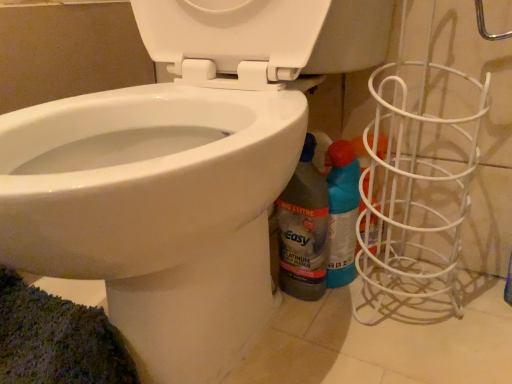
At what (x,y) coordinates should I click in order to perform the action: click on white glossy bidet at lower left. Please return your answer as a coordinate pair (x, y). Looking at the image, I should click on (156, 211).

Where is `translucent plastic bottle at lower right, the second cleaning product in the right-to-left sequence`? The image size is (512, 384). translucent plastic bottle at lower right, the second cleaning product in the right-to-left sequence is located at coordinates (304, 229).

From the image's perspective, would you say blue glossy spray can at lower right, which appears as the 1th cleaning product when viewed from the right, is shown under translucent plastic bottle at lower right, the second cleaning product in the right-to-left sequence?

Indeed, from the image's perspective, blue glossy spray can at lower right, which appears as the 1th cleaning product when viewed from the right, is shown beneath translucent plastic bottle at lower right, the second cleaning product in the right-to-left sequence.

From a real-world perspective, is blue glossy spray can at lower right, marked as the second cleaning product in a left-to-right arrangement, positioned under translucent plastic bottle at lower right, the second cleaning product in the right-to-left sequence, based on gravity?

Yes, from a real-world perspective, blue glossy spray can at lower right, marked as the second cleaning product in a left-to-right arrangement, is beneath translucent plastic bottle at lower right, the second cleaning product in the right-to-left sequence.

Does blue glossy spray can at lower right, marked as the second cleaning product in a left-to-right arrangement, come behind translucent plastic bottle at lower right, the second cleaning product in the right-to-left sequence?

Yes, blue glossy spray can at lower right, marked as the second cleaning product in a left-to-right arrangement, is further from the camera.

How different are the orientations of blue glossy spray can at lower right, which appears as the 1th cleaning product when viewed from the right, and translucent plastic bottle at lower right, the second cleaning product in the right-to-left sequence, in degrees?

They differ by 0.00751 degrees in their facing directions.

Is white glossy bidet at lower left aimed at blue glossy spray can at lower right, which appears as the 1th cleaning product when viewed from the right?

No, white glossy bidet at lower left is not facing towards blue glossy spray can at lower right, which appears as the 1th cleaning product when viewed from the right.

From a real-world perspective, which is physically above, white glossy bidet at lower left or blue glossy spray can at lower right, marked as the second cleaning product in a left-to-right arrangement?

In real-world perspective, white glossy bidet at lower left is above.

Locate an element on the screen. This screenshot has height=384, width=512. bidet above the blue glossy spray can at lower right, which appears as the 1th cleaning product when viewed from the right (from the image's perspective) is located at coordinates (156, 211).

Is white glossy bidet at lower left behind blue glossy spray can at lower right, which appears as the 1th cleaning product when viewed from the right?

No, the depth of white glossy bidet at lower left is less than that of blue glossy spray can at lower right, which appears as the 1th cleaning product when viewed from the right.

In the scene shown: Between blue glossy spray can at lower right, marked as the second cleaning product in a left-to-right arrangement, and white glossy bidet at lower left, which one has larger width?

With larger width is white glossy bidet at lower left.

Does blue glossy spray can at lower right, marked as the second cleaning product in a left-to-right arrangement, have a lesser height compared to white glossy bidet at lower left?

Correct, blue glossy spray can at lower right, marked as the second cleaning product in a left-to-right arrangement, is not as tall as white glossy bidet at lower left.

Which object is positioned more to the right, blue glossy spray can at lower right, marked as the second cleaning product in a left-to-right arrangement, or white glossy bidet at lower left?

From the viewer's perspective, blue glossy spray can at lower right, marked as the second cleaning product in a left-to-right arrangement, appears more on the right side.

Which of these two, white glossy bidet at lower left or translucent plastic bottle at lower right, the second cleaning product in the right-to-left sequence, is bigger?

Bigger between the two is white glossy bidet at lower left.

From a real-world perspective, is white glossy bidet at lower left physically located above or below translucent plastic bottle at lower right, the first cleaning product in the left-to-right sequence?

From a real-world perspective, white glossy bidet at lower left is physically above translucent plastic bottle at lower right, the first cleaning product in the left-to-right sequence.

Considering the positions of objects white glossy bidet at lower left and translucent plastic bottle at lower right, the first cleaning product in the left-to-right sequence, in the image provided, who is in front, white glossy bidet at lower left or translucent plastic bottle at lower right, the first cleaning product in the left-to-right sequence,?

white glossy bidet at lower left.

Is translucent plastic bottle at lower right, the first cleaning product in the left-to-right sequence, to the left or to the right of blue glossy spray can at lower right, marked as the second cleaning product in a left-to-right arrangement, in the image?

Based on their positions, translucent plastic bottle at lower right, the first cleaning product in the left-to-right sequence, is located to the left of blue glossy spray can at lower right, marked as the second cleaning product in a left-to-right arrangement.

How different are the orientations of translucent plastic bottle at lower right, the second cleaning product in the right-to-left sequence, and blue glossy spray can at lower right, which appears as the 1th cleaning product when viewed from the right, in degrees?

0.00751 degrees separate the facing orientations of translucent plastic bottle at lower right, the second cleaning product in the right-to-left sequence, and blue glossy spray can at lower right, which appears as the 1th cleaning product when viewed from the right.

Is translucent plastic bottle at lower right, the second cleaning product in the right-to-left sequence, located outside blue glossy spray can at lower right, which appears as the 1th cleaning product when viewed from the right?

Yes.

Looking at this image, which of these two, translucent plastic bottle at lower right, the first cleaning product in the left-to-right sequence, or blue glossy spray can at lower right, which appears as the 1th cleaning product when viewed from the right, stands taller?

Standing taller between the two is translucent plastic bottle at lower right, the first cleaning product in the left-to-right sequence.

What's the angular difference between translucent plastic bottle at lower right, the second cleaning product in the right-to-left sequence, and white glossy bidet at lower left's facing directions?

The angular difference between translucent plastic bottle at lower right, the second cleaning product in the right-to-left sequence, and white glossy bidet at lower left is 2.35 degrees.

Is translucent plastic bottle at lower right, the first cleaning product in the left-to-right sequence, turned away from white glossy bidet at lower left?

Absolutely, translucent plastic bottle at lower right, the first cleaning product in the left-to-right sequence, is directed away from white glossy bidet at lower left.

From a real-world perspective, starting from the white glossy bidet at lower left, which cleaning product is the 1st one below it? Please provide its 2D coordinates.

[(304, 229)]

Between translucent plastic bottle at lower right, the first cleaning product in the left-to-right sequence, and white glossy bidet at lower left, which one has larger size?

Bigger between the two is white glossy bidet at lower left.

Identify the location of cleaning product below the translucent plastic bottle at lower right, the second cleaning product in the right-to-left sequence (from a real-world perspective). This screenshot has height=384, width=512. (342, 212).

From the image's perspective, count 2nd cleaning products downward from the white glossy bidet at lower left and point to it. Please provide its 2D coordinates.

[(342, 212)]

From the image, which object appears to be nearer to white glossy bidet at lower left, blue glossy spray can at lower right, which appears as the 1th cleaning product when viewed from the right, or translucent plastic bottle at lower right, the second cleaning product in the right-to-left sequence?

translucent plastic bottle at lower right, the second cleaning product in the right-to-left sequence, is closer to white glossy bidet at lower left.

When comparing their distances from white glossy bidet at lower left, does translucent plastic bottle at lower right, the first cleaning product in the left-to-right sequence, or blue glossy spray can at lower right, which appears as the 1th cleaning product when viewed from the right, seem further?

blue glossy spray can at lower right, which appears as the 1th cleaning product when viewed from the right, lies further to white glossy bidet at lower left than the other object.

From the image, which object appears to be nearer to translucent plastic bottle at lower right, the first cleaning product in the left-to-right sequence, blue glossy spray can at lower right, which appears as the 1th cleaning product when viewed from the right, or white glossy bidet at lower left?

blue glossy spray can at lower right, which appears as the 1th cleaning product when viewed from the right, is positioned closer to the anchor translucent plastic bottle at lower right, the first cleaning product in the left-to-right sequence.

When comparing their distances from blue glossy spray can at lower right, marked as the second cleaning product in a left-to-right arrangement, does translucent plastic bottle at lower right, the second cleaning product in the right-to-left sequence, or white glossy bidet at lower left seem closer?

translucent plastic bottle at lower right, the second cleaning product in the right-to-left sequence.

From the image, which object appears to be farther from blue glossy spray can at lower right, marked as the second cleaning product in a left-to-right arrangement, white glossy bidet at lower left or translucent plastic bottle at lower right, the first cleaning product in the left-to-right sequence?

Among the two, white glossy bidet at lower left is located further to blue glossy spray can at lower right, marked as the second cleaning product in a left-to-right arrangement.

Estimate the real-world distances between objects in this image. Which object is further from translucent plastic bottle at lower right, the second cleaning product in the right-to-left sequence, white glossy bidet at lower left or blue glossy spray can at lower right, marked as the second cleaning product in a left-to-right arrangement?

white glossy bidet at lower left is positioned further to the anchor translucent plastic bottle at lower right, the second cleaning product in the right-to-left sequence.

Find the location of a particular element. The image size is (512, 384). cleaning product between white glossy bidet at lower left and blue glossy spray can at lower right, which appears as the 1th cleaning product when viewed from the right, along the z-axis is located at coordinates (304, 229).